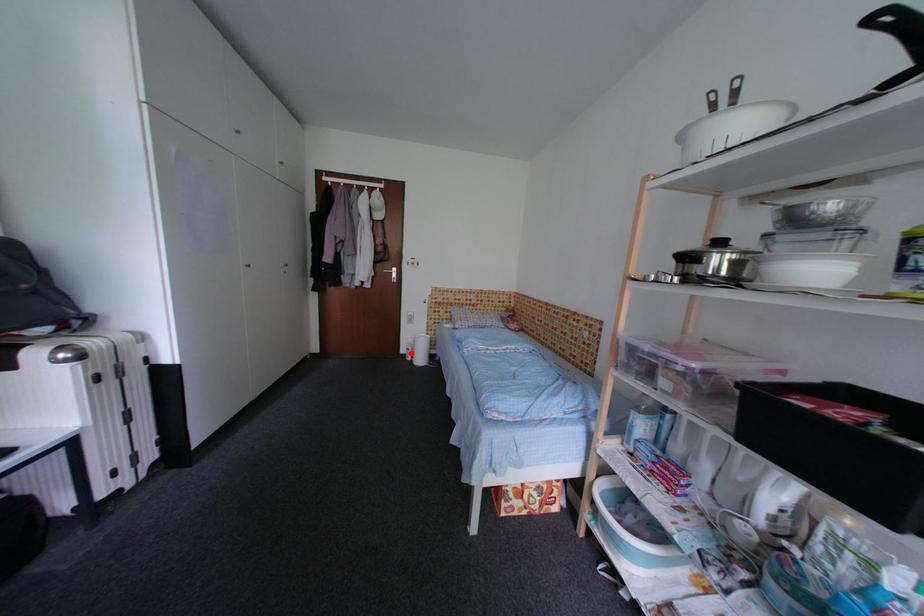
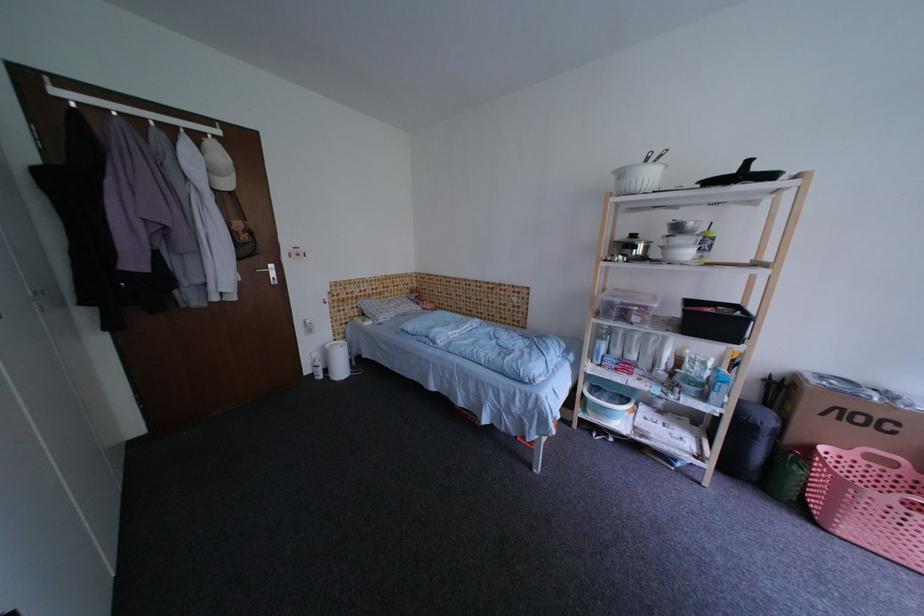
Question: I am providing you with two images of the same scene from different viewpoints. Image1 has a red point marked. In image2, the corresponding 3D location appears at what relative position? Reply with the corresponding letter.

Choices:
 (A) Closer
 (B) Farther

Answer: (A)